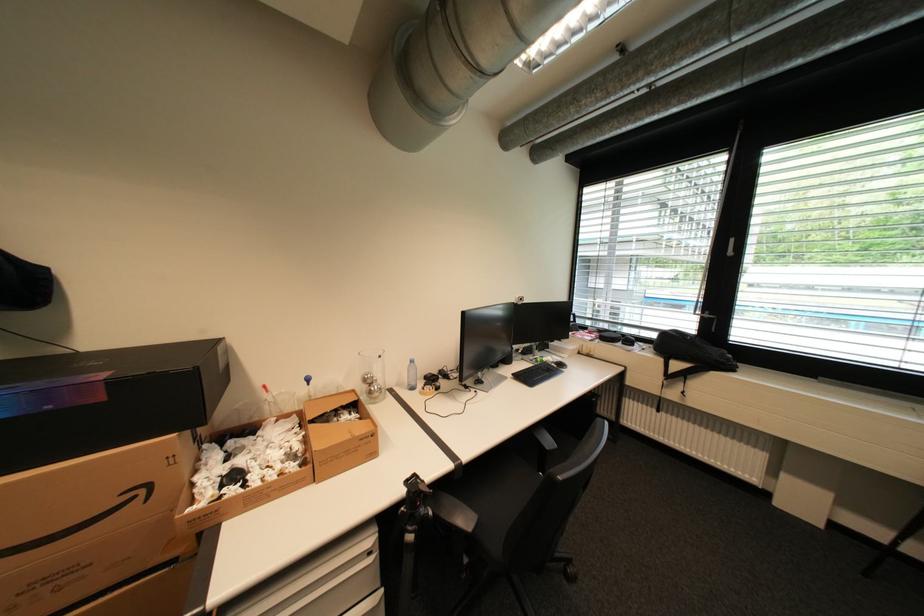
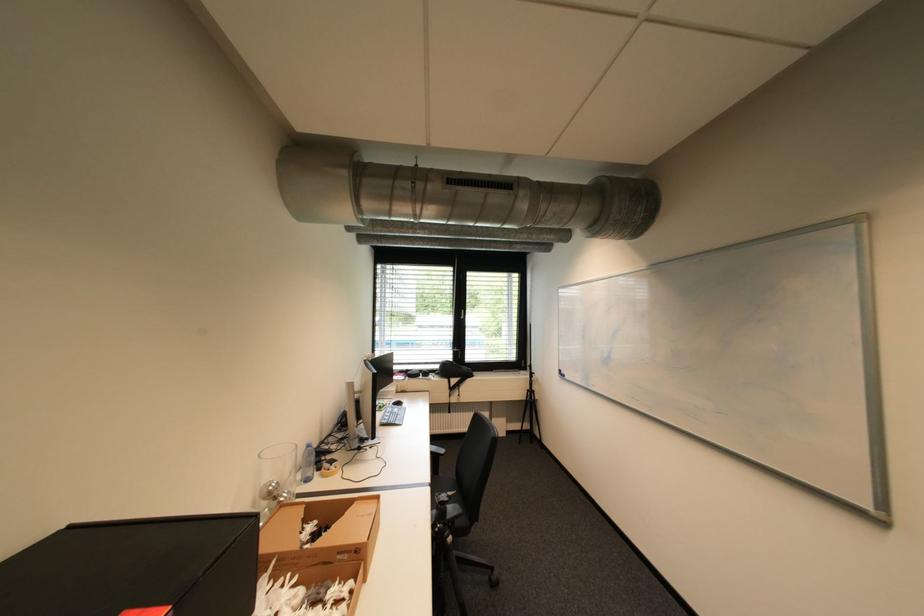
Where in the second image is the point corresponding to (x=418, y=365) from the first image?

(313, 451)